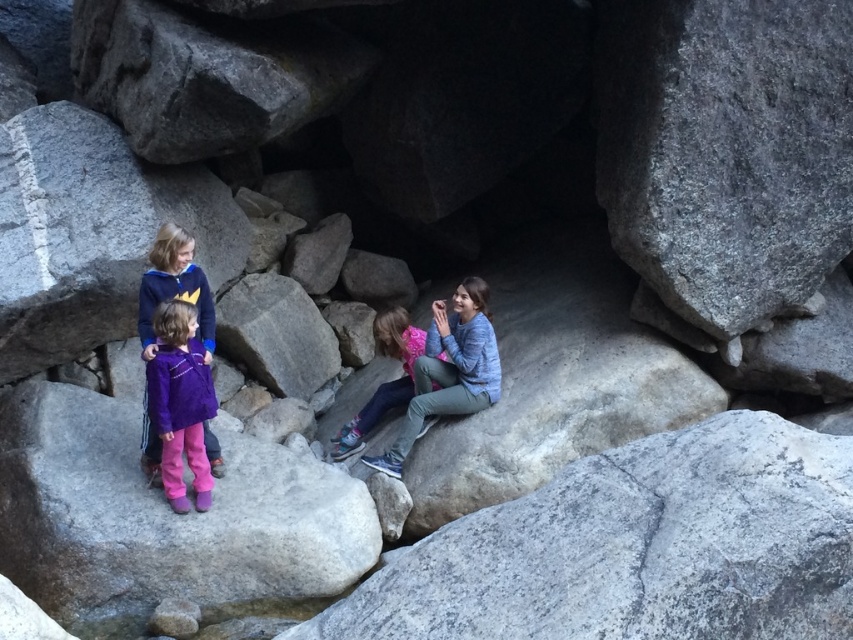
Which is in front, point (384, 592) or point (85, 536)?

Point (384, 592) is in front.

Does gray rough rock at center appear under purple fabric pants at lower left?

No, gray rough rock at center is not below purple fabric pants at lower left.

You are a GUI agent. You are given a task and a screenshot of the screen. Output one action in this format:
    pyautogui.click(x=<x>, y=<y>)
    Task: Click on the gray rough rock at center
    The width and height of the screenshot is (853, 640).
    Given the screenshot: What is the action you would take?
    pyautogui.click(x=636, y=548)

Is point (538, 605) farther from camera compared to point (190, 468)?

No.

Where is `gray rough rock at center`? Image resolution: width=853 pixels, height=640 pixels. gray rough rock at center is located at coordinates (636, 548).

Can you confirm if purple fabric pants at lower left is positioned above pink fleece jacket at center?

No, purple fabric pants at lower left is not above pink fleece jacket at center.

I want to click on purple fabric pants at lower left, so click(x=163, y=518).

I want to click on purple fabric pants at lower left, so click(x=163, y=518).